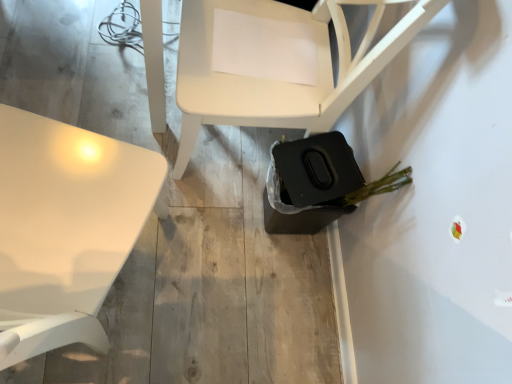
Image resolution: width=512 pixels, height=384 pixels. Identify the location of free spot to the right of white glossy table at upper left. (231, 303).